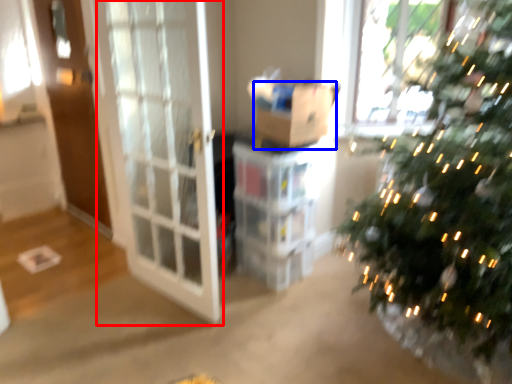
Question: Which object appears closest to the camera in this image, screen door (highlighted by a red box) or cardboard box (highlighted by a blue box)?

Choices:
 (A) screen door
 (B) cardboard box

Answer: (A)